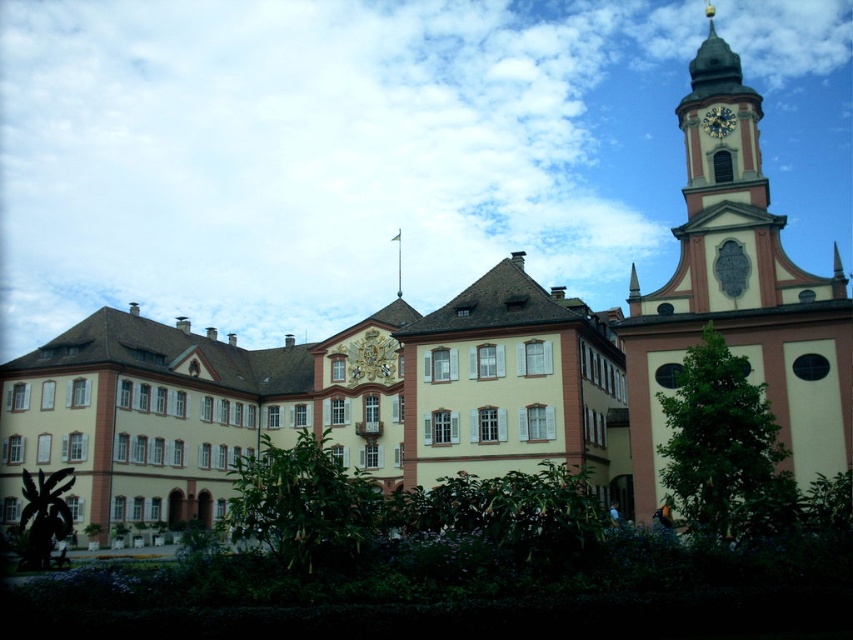
Question: Can you confirm if beige stone clock tower at upper right is bigger than gold metallic clock at upper right?

Choices:
 (A) no
 (B) yes

Answer: (B)

Question: Is beige stone clock tower at upper right to the left of gold metallic clock at upper right from the viewer's perspective?

Choices:
 (A) no
 (B) yes

Answer: (A)

Question: Which of the following is the farthest from the observer?

Choices:
 (A) beige stone clock tower at upper right
 (B) gold metallic clock at upper right

Answer: (B)

Question: Is beige stone clock tower at upper right below gold metallic clock at upper right?

Choices:
 (A) yes
 (B) no

Answer: (A)